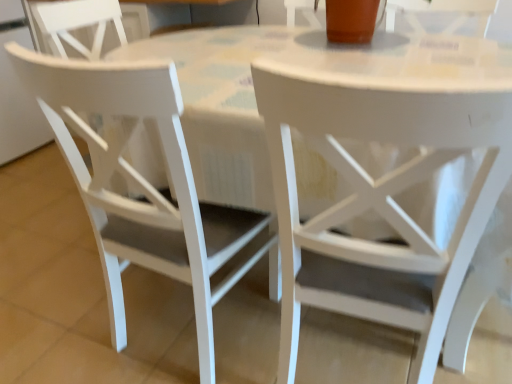
You are a GUI agent. You are given a task and a screenshot of the screen. Output one action in this format:
    pyautogui.click(x=<x>, y=<y>)
    Task: Click on the white matte chair at center, positioned as the second chair in left-to-right order
    
    Given the screenshot: What is the action you would take?
    pyautogui.click(x=379, y=197)

Image resolution: width=512 pixels, height=384 pixels. Describe the element at coordinates (379, 197) in the screenshot. I see `white matte chair at center, which is counted as the first chair, starting from the right` at that location.

What do you see at coordinates (141, 184) in the screenshot? I see `white matte chair at left, which is the 2th chair in right-to-left order` at bounding box center [141, 184].

At what (x,y) coordinates should I click in order to perform the action: click on white matte chair at left, the 1th chair when ordered from left to right. Please return your answer as a coordinate pair (x, y). This screenshot has width=512, height=384. Looking at the image, I should click on (141, 184).

Image resolution: width=512 pixels, height=384 pixels. What are the coordinates of `white matte chair at center, positioned as the second chair in left-to-right order` in the screenshot? It's located at (379, 197).

Does white matte chair at center, which is counted as the first chair, starting from the right, appear on the left side of white matte chair at left, the 1th chair when ordered from left to right?

Incorrect, white matte chair at center, which is counted as the first chair, starting from the right, is not on the left side of white matte chair at left, the 1th chair when ordered from left to right.

Is white matte chair at center, positioned as the second chair in left-to-right order, behind white matte chair at left, which is the 2th chair in right-to-left order?

No, white matte chair at center, positioned as the second chair in left-to-right order, is closer to the camera.

Between point (325, 300) and point (187, 166), which one is positioned in front?

The point (187, 166) is more forward.

From the image's perspective, who appears lower, white matte chair at center, which is counted as the first chair, starting from the right, or white matte chair at left, the 1th chair when ordered from left to right?

white matte chair at center, which is counted as the first chair, starting from the right, from the image's perspective.

From a real-world perspective, which is physically below, white matte chair at center, which is counted as the first chair, starting from the right, or white matte chair at left, which is the 2th chair in right-to-left order?

In real-world perspective, white matte chair at center, which is counted as the first chair, starting from the right, is lower.

Can you confirm if white matte chair at center, which is counted as the first chair, starting from the right, is wider than white matte chair at left, which is the 2th chair in right-to-left order?

Yes, white matte chair at center, which is counted as the first chair, starting from the right, is wider than white matte chair at left, which is the 2th chair in right-to-left order.

Between white matte chair at center, positioned as the second chair in left-to-right order, and white matte chair at left, the 1th chair when ordered from left to right, which one has more height?

Standing taller between the two is white matte chair at center, positioned as the second chair in left-to-right order.

Considering the relative sizes of white matte chair at center, which is counted as the first chair, starting from the right, and white matte chair at left, which is the 2th chair in right-to-left order, in the image provided, is white matte chair at center, which is counted as the first chair, starting from the right, smaller than white matte chair at left, which is the 2th chair in right-to-left order,?

Incorrect, white matte chair at center, which is counted as the first chair, starting from the right, is not smaller in size than white matte chair at left, which is the 2th chair in right-to-left order.

Consider the image. Is white matte chair at center, which is counted as the first chair, starting from the right, outside of white matte chair at left, the 1th chair when ordered from left to right?

That's correct, white matte chair at center, which is counted as the first chair, starting from the right, is outside of white matte chair at left, the 1th chair when ordered from left to right.

Is white matte chair at center, positioned as the second chair in left-to-right order, not near white matte chair at left, which is the 2th chair in right-to-left order?

They are positioned close to each other.

Could you tell me if white matte chair at center, positioned as the second chair in left-to-right order, is facing white matte chair at left, which is the 2th chair in right-to-left order?

No, white matte chair at center, positioned as the second chair in left-to-right order, does not turn towards white matte chair at left, which is the 2th chair in right-to-left order.

Where is `chair that is in front of the white matte chair at left, the 1th chair when ordered from left to right`? Image resolution: width=512 pixels, height=384 pixels. chair that is in front of the white matte chair at left, the 1th chair when ordered from left to right is located at coordinates (379, 197).

Consider the image. Which is more to the left, white matte chair at left, which is the 2th chair in right-to-left order, or white matte chair at center, which is counted as the first chair, starting from the right?

Positioned to the left is white matte chair at left, which is the 2th chair in right-to-left order.

Which is behind, white matte chair at left, the 1th chair when ordered from left to right, or white matte chair at center, which is counted as the first chair, starting from the right?

white matte chair at left, the 1th chair when ordered from left to right, is further away from the camera.

Which is nearer, (x=177, y=235) or (x=467, y=239)?

Point (x=177, y=235) is farther from the camera than point (x=467, y=239).

From the image's perspective, does white matte chair at left, the 1th chair when ordered from left to right, appear lower than white matte chair at center, which is counted as the first chair, starting from the right?

No, from the image's perspective, white matte chair at left, the 1th chair when ordered from left to right, is not below white matte chair at center, which is counted as the first chair, starting from the right.

From a real-world perspective, is white matte chair at left, the 1th chair when ordered from left to right, positioned above or below white matte chair at center, positioned as the second chair in left-to-right order?

white matte chair at left, the 1th chair when ordered from left to right, is situated higher than white matte chair at center, positioned as the second chair in left-to-right order, in the real world.

Considering the sizes of objects white matte chair at left, which is the 2th chair in right-to-left order, and white matte chair at center, positioned as the second chair in left-to-right order, in the image provided, who is thinner, white matte chair at left, which is the 2th chair in right-to-left order, or white matte chair at center, positioned as the second chair in left-to-right order,?

white matte chair at left, which is the 2th chair in right-to-left order.

Who is taller, white matte chair at left, which is the 2th chair in right-to-left order, or white matte chair at center, positioned as the second chair in left-to-right order?

With more height is white matte chair at center, positioned as the second chair in left-to-right order.

Between white matte chair at left, the 1th chair when ordered from left to right, and white matte chair at center, positioned as the second chair in left-to-right order, which one has larger size?

white matte chair at center, positioned as the second chair in left-to-right order.

Could white matte chair at center, which is counted as the first chair, starting from the right, be considered to be inside white matte chair at left, the 1th chair when ordered from left to right?

Actually, white matte chair at center, which is counted as the first chair, starting from the right, is outside white matte chair at left, the 1th chair when ordered from left to right.

Is white matte chair at left, the 1th chair when ordered from left to right, with white matte chair at center, which is counted as the first chair, starting from the right?

There is a gap between white matte chair at left, the 1th chair when ordered from left to right, and white matte chair at center, which is counted as the first chair, starting from the right.

Does white matte chair at left, which is the 2th chair in right-to-left order, turn towards white matte chair at center, positioned as the second chair in left-to-right order?

No, white matte chair at left, which is the 2th chair in right-to-left order, is not turned towards white matte chair at center, positioned as the second chair in left-to-right order.

Can you tell me how much white matte chair at left, the 1th chair when ordered from left to right, and white matte chair at center, which is counted as the first chair, starting from the right, differ in facing direction?

The angle between the facing direction of white matte chair at left, the 1th chair when ordered from left to right, and the facing direction of white matte chair at center, which is counted as the first chair, starting from the right, is 0.000313 degrees.

The image size is (512, 384). Identify the location of chair that appears on the right of white matte chair at left, which is the 2th chair in right-to-left order. (379, 197).

Locate an element on the screen. The height and width of the screenshot is (384, 512). chair that is in front of the white matte chair at left, which is the 2th chair in right-to-left order is located at coordinates (379, 197).

The height and width of the screenshot is (384, 512). Find the location of `chair lying on the right of white matte chair at left, which is the 2th chair in right-to-left order`. chair lying on the right of white matte chair at left, which is the 2th chair in right-to-left order is located at coordinates pos(379,197).